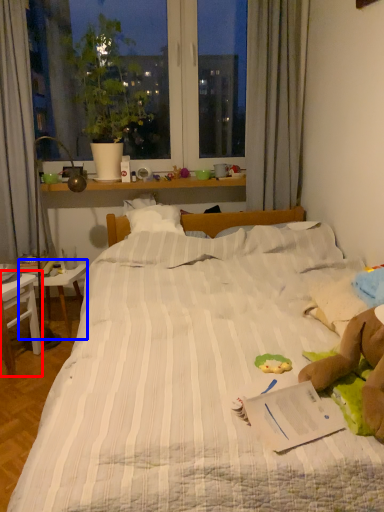
Question: Which object is closer to the camera taking this photo, table (highlighted by a red box) or table (highlighted by a blue box)?

Choices:
 (A) table
 (B) table

Answer: (A)